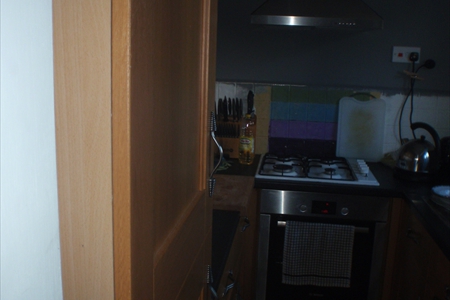
Where is `grab here to open cabinet`? The width and height of the screenshot is (450, 300). grab here to open cabinet is located at coordinates (213, 287), (220, 148).